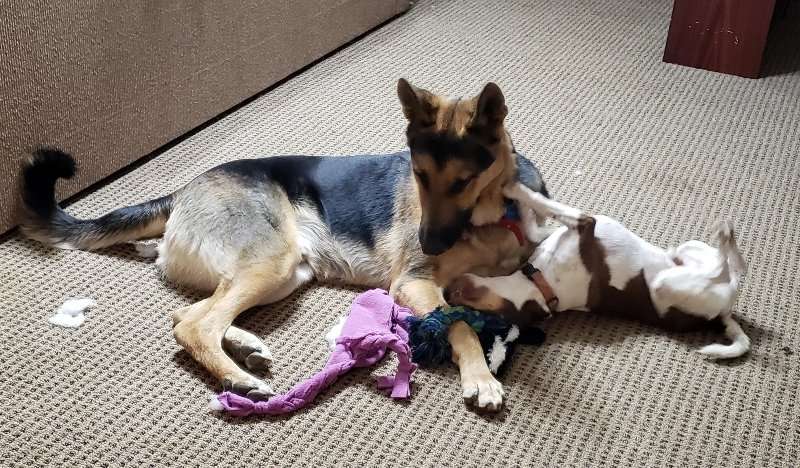
I want to click on white tissues, so click(x=54, y=316), click(x=133, y=247).